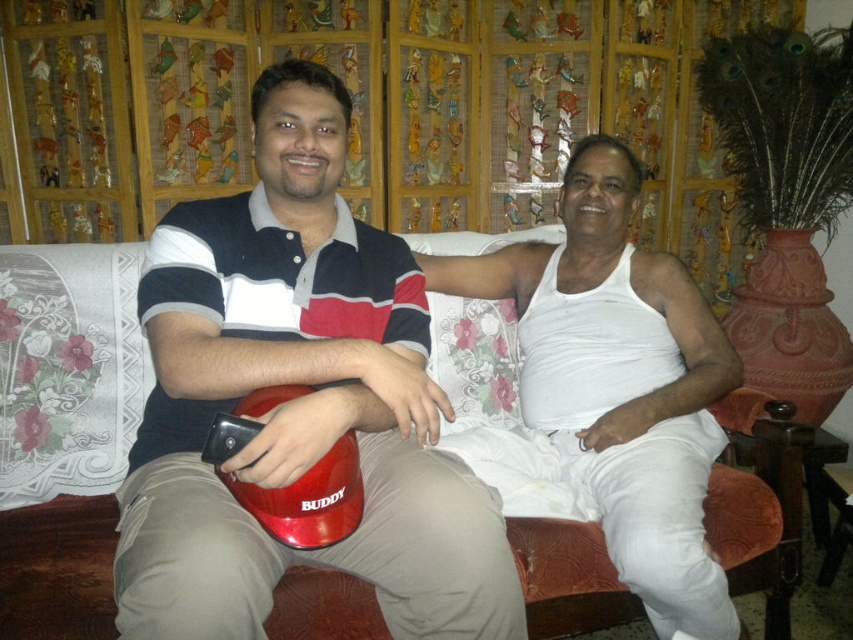
Is matte plastic helmet at center below white cotton tank top at center?

No.

Consider the image. Who is shorter, matte plastic helmet at center or white cotton tank top at center?

matte plastic helmet at center

Does point (479, 552) come in front of point (610, 465)?

Yes, point (479, 552) is in front of point (610, 465).

Locate an element on the screen. The height and width of the screenshot is (640, 853). matte plastic helmet at center is located at coordinates (297, 401).

Does matte plastic helmet at center come in front of velvet-like orange couch at center?

That is True.

How far apart are matte plastic helmet at center and velvet-like orange couch at center?

16.40 inches

Does point (451, 524) come behind point (114, 472)?

No, it is in front of (114, 472).

Identify the location of matte plastic helmet at center. (297, 401).

Is point (77, 264) behind point (706, 394)?

No, it is in front of (706, 394).

Measure the distance from velvet-like orange couch at center to white cotton tank top at center.

The distance of velvet-like orange couch at center from white cotton tank top at center is 88.00 centimeters.

You are a GUI agent. You are given a task and a screenshot of the screen. Output one action in this format:
    pyautogui.click(x=<x>, y=<y>)
    Task: Click on the velvet-like orange couch at center
    
    Given the screenshot: What is the action you would take?
    pyautogui.click(x=64, y=432)